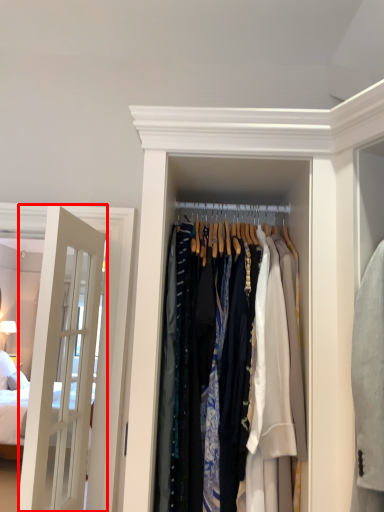
Question: In this image, where is door (annotated by the red box) located relative to closet?

Choices:
 (A) right
 (B) left

Answer: (B)